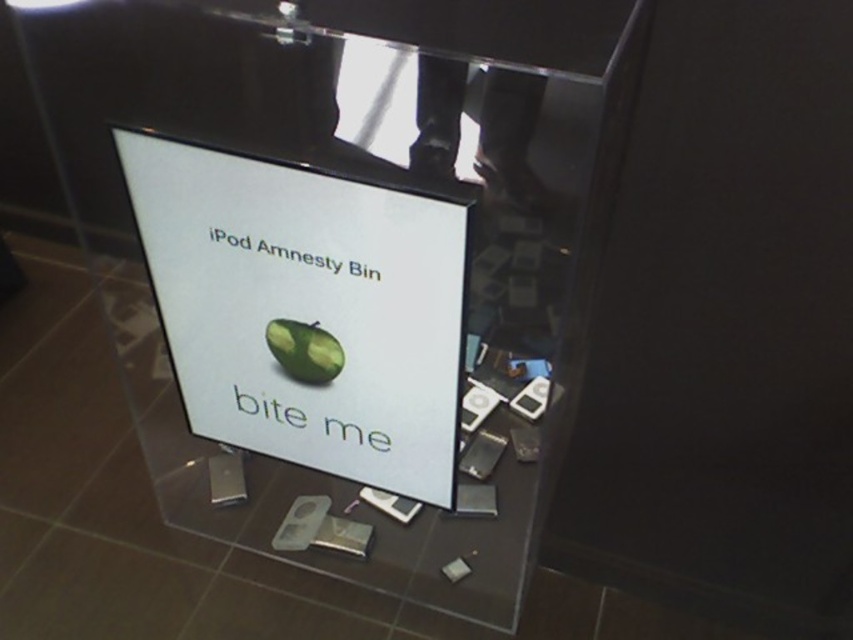
Is white glossy sign at center below green matte avocado at center?

Incorrect, white glossy sign at center is not positioned below green matte avocado at center.

Does point (337, 380) come farther from viewer compared to point (315, 332)?

Yes, point (337, 380) is farther from viewer.

Where is `white glossy sign at center`? This screenshot has height=640, width=853. white glossy sign at center is located at coordinates (305, 308).